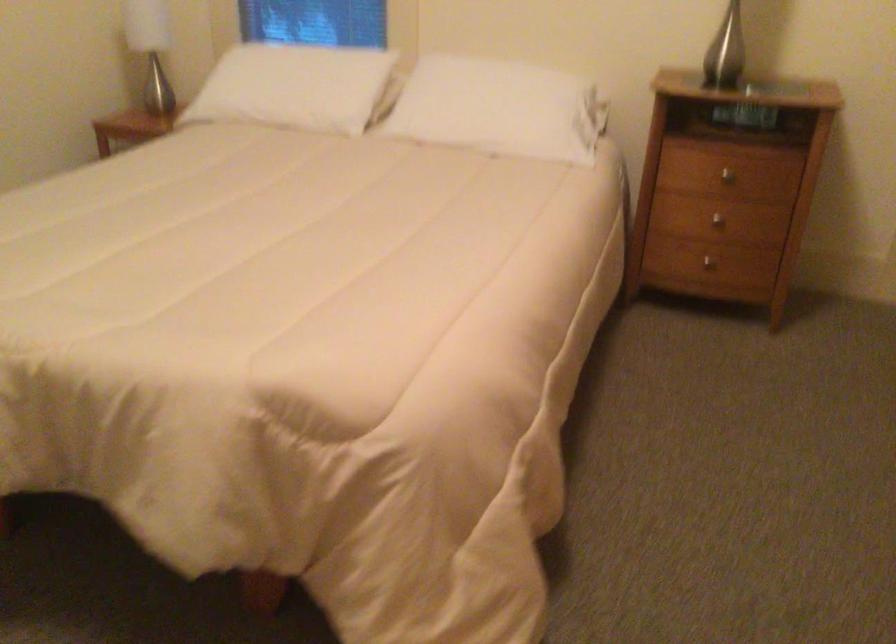
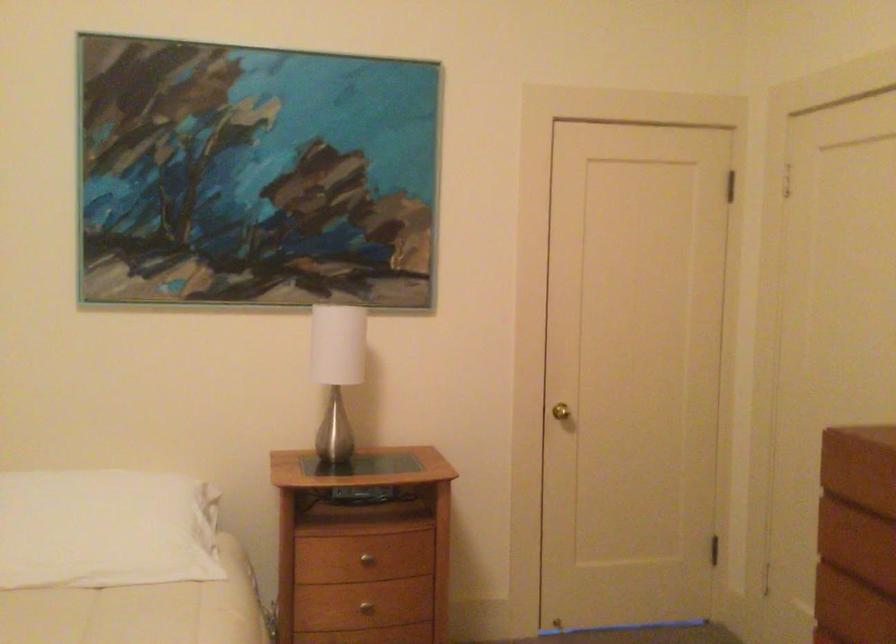
First-person continuous shooting, in which direction is the camera rotating?

The camera's rotation is toward right-up.